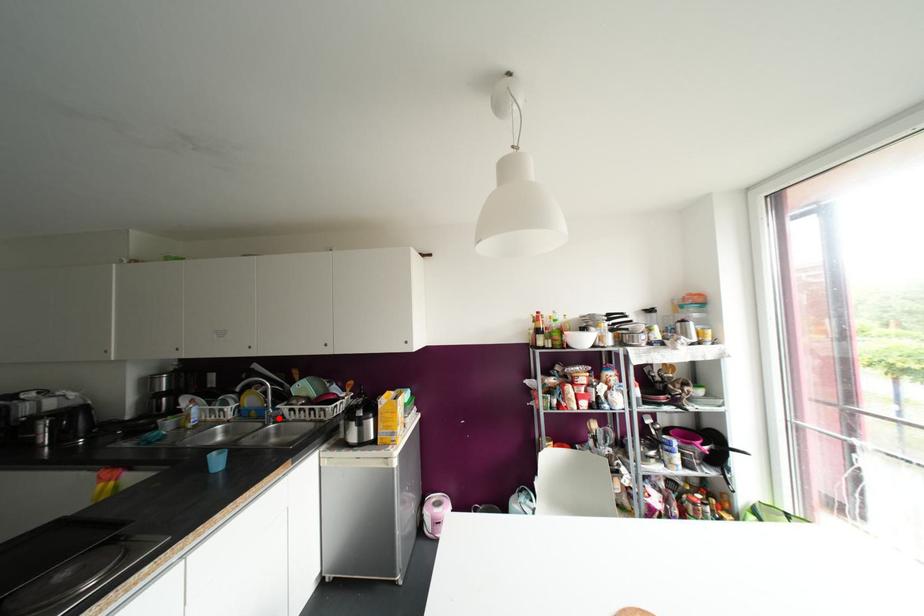
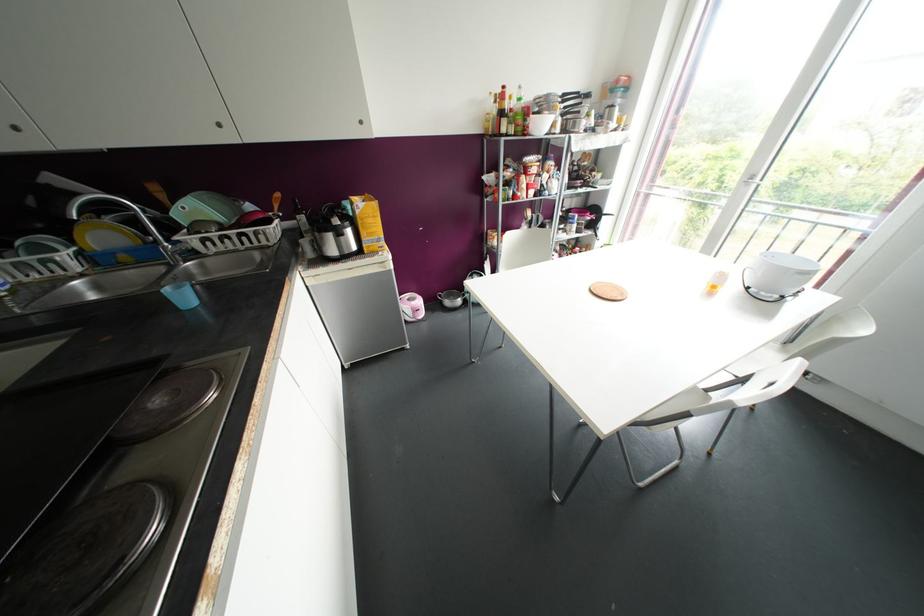
Question: A red point is marked in image1. In image2, is the corresponding 3D point closer to the camera or farther? Reply with the corresponding letter.

Choices:
 (A) The corresponding 3D point is closer.
 (B) The corresponding 3D point is farther.

Answer: (A)